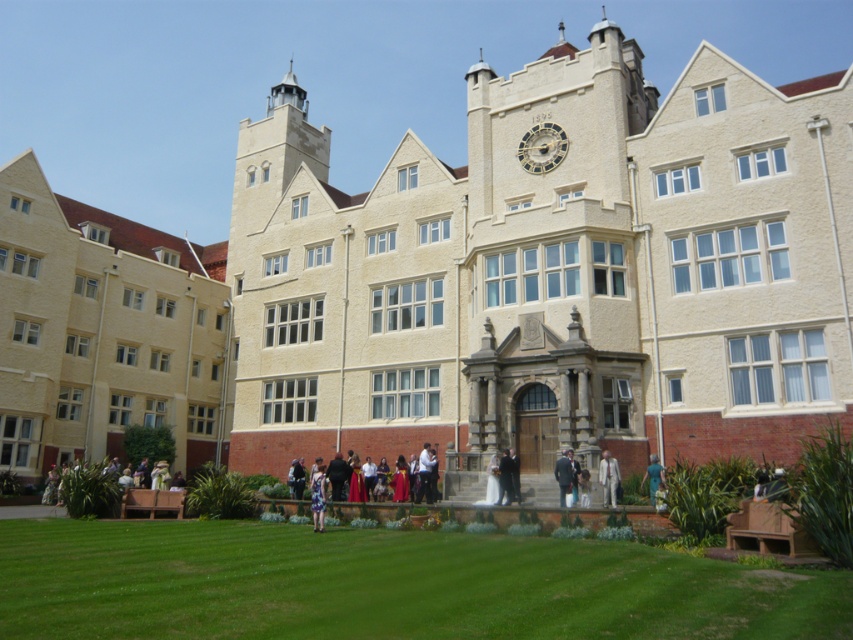
You are an event planner organizing a formal event at the grand building. You need to place two suits in the center area. The dark gray suit at center and the light gray suit at center must be arranged according to their positions. Which suit should be placed higher to ensure proper alignment with the building architecture?

The light gray suit at center should be placed higher because the dark gray suit at center is positioned under it, maintaining the hierarchical structure typical of such formal architectural designs.

You are attending a formal event and need to choose between two suits displayed in the image. The dark gray suit at center and the light gray suit at center. Which suit is narrower?

The dark gray suit at center is narrower than the light gray suit at center.

You are standing at the entrance of the grand building and want to locate two specific points on its facade. The first point is at coordinates point [520,156] and the second is at point [605,461]. Which point is closer to you?

Point [605,461] is closer to you because it is in front of point [520,156].